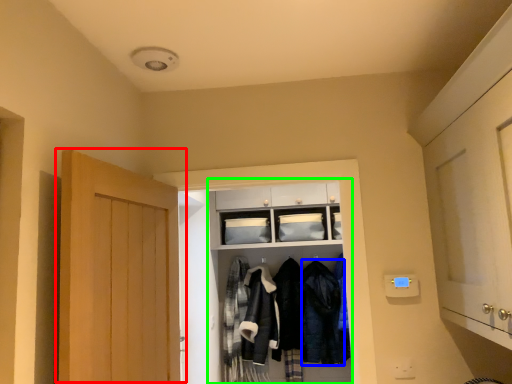
Question: Which is nearer to the door (highlighted by a red box)? clothing (highlighted by a blue box) or closet (highlighted by a green box).

Choices:
 (A) clothing
 (B) closet

Answer: (B)